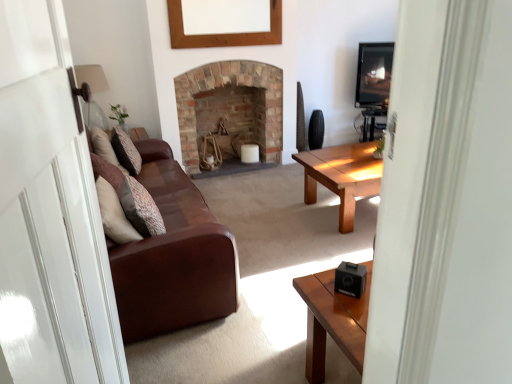
Identify the location of empty space that is ontop of wooden picture frame at upper center (from a real-world perspective). (216, 0).